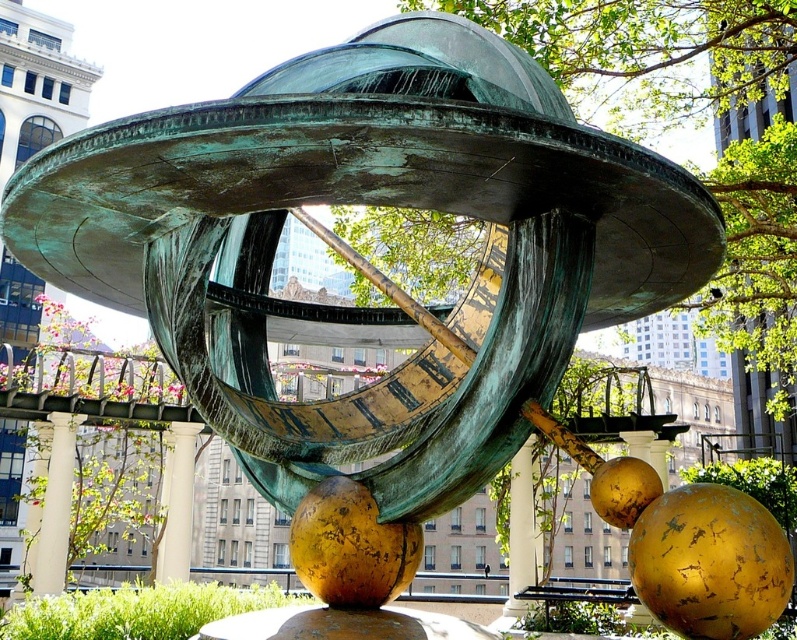
Based on the photo, based on the scene description, which pillar is taller between the white marble pillar at center and the green patina pillar at center?

The green patina pillar at center is taller than the white marble pillar at center according to the description.

You are standing at the base of the sculpture and want to locate two points marked on the ground. The first point is at coordinates point (53, 433) and the second is at point (191, 424). From your vantage point, which point is closer to you?

Point (53, 433) is in front of point (191, 424), so it is closer to you.

You are an architect designing a new plaza and want to place a bench near the white marble pillar at center. Based on the sculpture layout, where should the bench be positioned relative to the pillar to ensure it doesn not obstruct the view of the sculpture?

The bench should be placed behind the white marble pillar at center to avoid blocking the view of the sculpture.